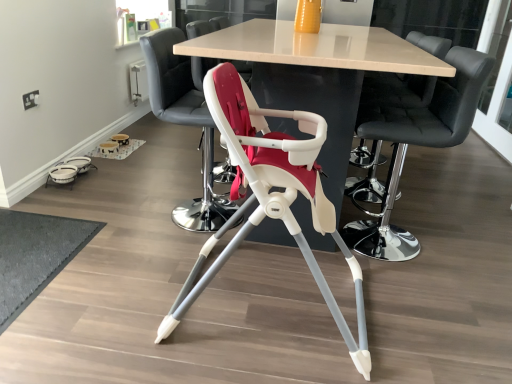
Identify the location of vacant space to the left of matte white highchair at center, which appears as the 2th chair when viewed from the left. The image size is (512, 384). (118, 291).